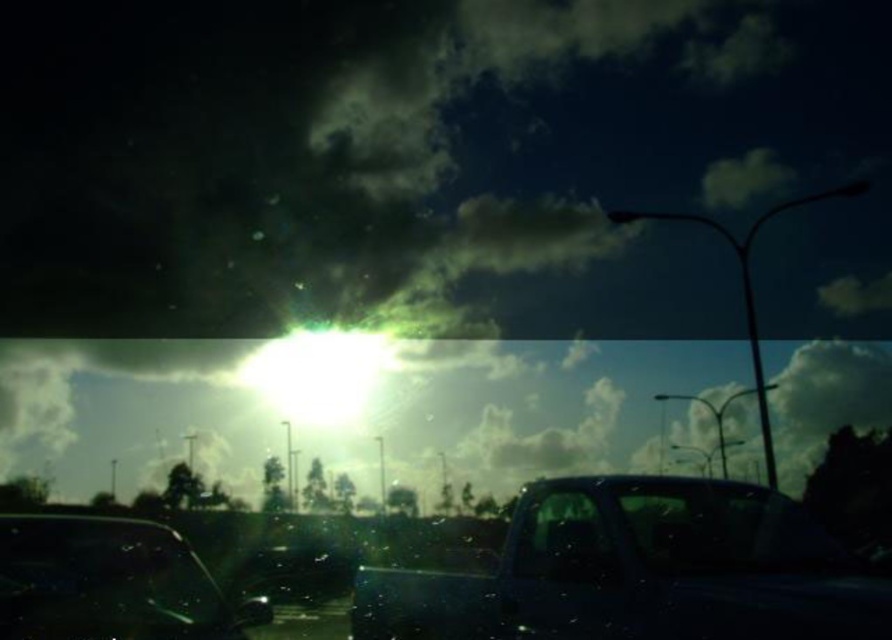
You are a pedestrian standing on the side of the road. You see the shiny black truck at center and the transparent glass car window at center. Which object is taller?

The shiny black truck at center is taller than the transparent glass car window at center according to the description.